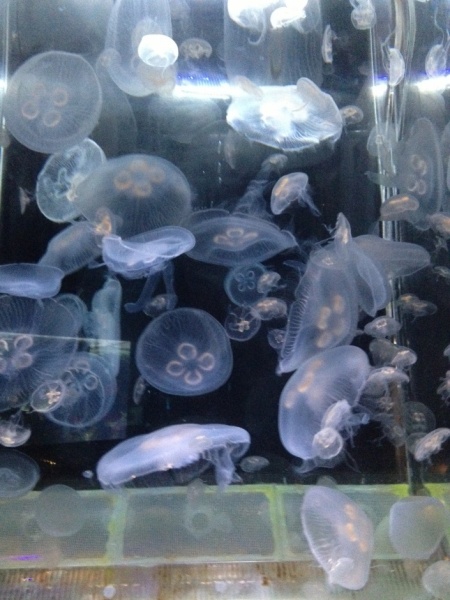
Identify the location of wall behind enclosure. The height and width of the screenshot is (600, 450). (262, 529).